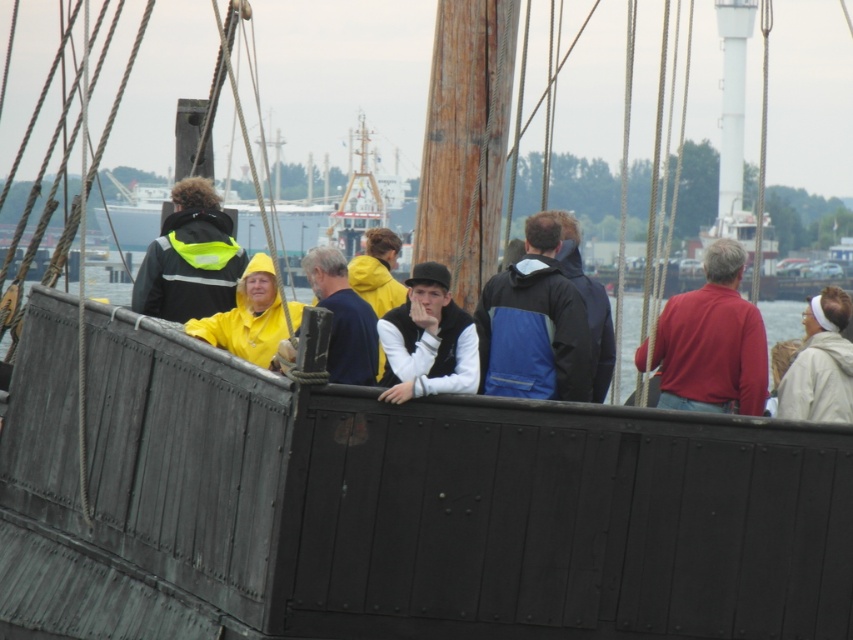
Question: Estimate the real-world distances between objects in this image. Which object is closer to the neon yellow raincoat at center?

Choices:
 (A) matte black vest at center
 (B) white fleece jacket at right

Answer: (B)

Question: Can you confirm if matte black vest at center is wider than yellow matte jacket at center?

Choices:
 (A) no
 (B) yes

Answer: (B)

Question: Which point is closer to the camera?

Choices:
 (A) matte black vest at center
 (B) white fleece jacket at right

Answer: (A)

Question: Is matte red shirt at center smaller than neon yellow raincoat at center?

Choices:
 (A) no
 (B) yes

Answer: (B)

Question: Can you confirm if blue fabric jacket at center is positioned to the left of matte red shirt at center?

Choices:
 (A) yes
 (B) no

Answer: (A)

Question: Which point is closer to the camera taking this photo?

Choices:
 (A) (544, 253)
 (B) (610, 314)
 (C) (843, 349)

Answer: (C)